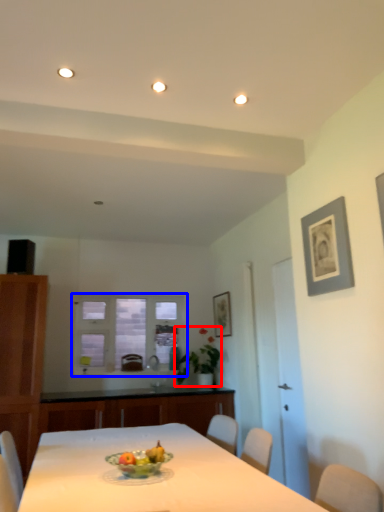
Question: Among these objects, which one is nearest to the camera, plant (highlighted by a red box) or window (highlighted by a blue box)?

Choices:
 (A) plant
 (B) window

Answer: (A)